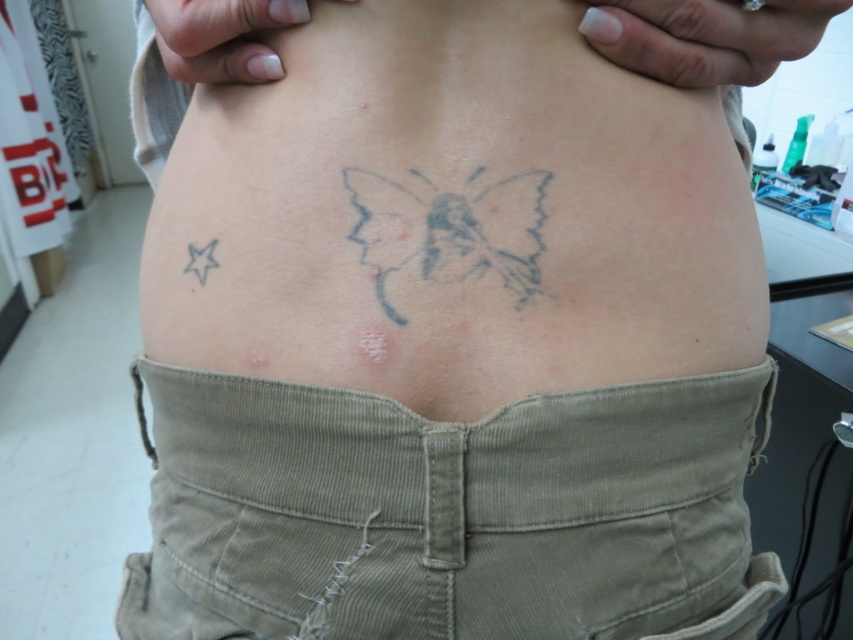
You are a dermatologist examining a patient. The patient has a corduroy fabric at center and a gray ink butterfly at center on their lower back. Which object is closer to your viewpoint when looking at the lower back area?

The corduroy fabric at center is closer to your viewpoint because it is in front of the gray ink butterfly at center.

You are a tailor measuring the lower back area of a client who wants to add a new patch pocket. The client has a corduroy fabric at center and a gray ink butterfly at center. Which object is taller in this area?

The corduroy fabric at center has a greater height compared to the gray ink butterfly at center, so the corduroy fabric at center is taller in this area.

You are a dermatologist examining a patient. You notice a point at coordinates (450, 515) on their lower back. Based on the scene, what is the most likely material at this location?

The point at coordinates (450, 515) corresponds to corduroy fabric at center, so the material at this location is corduroy fabric.